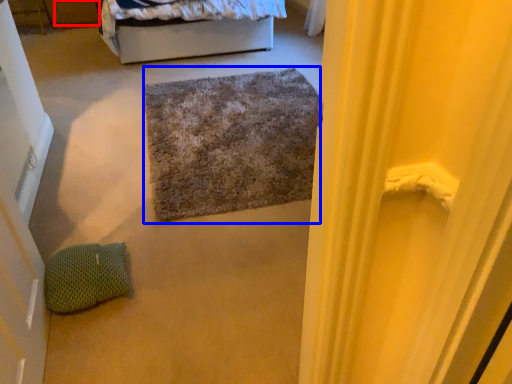
Question: Which object is further to the camera taking this photo, drawer (highlighted by a red box) or doormat (highlighted by a blue box)?

Choices:
 (A) drawer
 (B) doormat

Answer: (A)